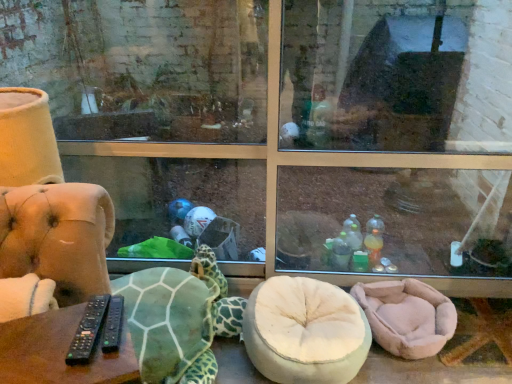
Question: Are black plastic remotes at lower left and pink plush bean bag at lower right far apart?

Choices:
 (A) yes
 (B) no

Answer: (A)

Question: Considering the relative sizes of black plastic remotes at lower left and pink plush bean bag at lower right in the image provided, is black plastic remotes at lower left bigger than pink plush bean bag at lower right?

Choices:
 (A) yes
 (B) no

Answer: (A)

Question: From a real-world perspective, is black plastic remotes at lower left over pink plush bean bag at lower right?

Choices:
 (A) no
 (B) yes

Answer: (B)

Question: Considering the relative sizes of black plastic remotes at lower left and pink plush bean bag at lower right in the image provided, is black plastic remotes at lower left taller than pink plush bean bag at lower right?

Choices:
 (A) no
 (B) yes

Answer: (B)

Question: Does black plastic remotes at lower left have a lesser height compared to pink plush bean bag at lower right?

Choices:
 (A) no
 (B) yes

Answer: (A)

Question: Based on their sizes in the image, would you say green textured fabric tortoise at lower left is bigger or smaller than pink plush bean bag at lower right?

Choices:
 (A) big
 (B) small

Answer: (A)

Question: From the image's perspective, is green textured fabric tortoise at lower left above or below pink plush bean bag at lower right?

Choices:
 (A) below
 (B) above

Answer: (B)

Question: Considering the positions of green textured fabric tortoise at lower left and pink plush bean bag at lower right in the image, is green textured fabric tortoise at lower left wider or thinner than pink plush bean bag at lower right?

Choices:
 (A) thin
 (B) wide

Answer: (B)

Question: In the image, is green textured fabric tortoise at lower left positioned in front of or behind pink plush bean bag at lower right?

Choices:
 (A) front
 (B) behind

Answer: (A)

Question: Which is correct: black plastic remotes at lower left is inside pink plush bean bag at lower right, or outside of it?

Choices:
 (A) outside
 (B) inside

Answer: (A)

Question: Considering their positions, is black plastic remotes at lower left located in front of or behind pink plush bean bag at lower right?

Choices:
 (A) front
 (B) behind

Answer: (A)

Question: In the image, is black plastic remotes at lower left on the left side or the right side of pink plush bean bag at lower right?

Choices:
 (A) right
 (B) left

Answer: (B)

Question: From the image's perspective, relative to pink plush bean bag at lower right, is black plastic remotes at lower left above or below?

Choices:
 (A) above
 (B) below

Answer: (A)

Question: In the image, is pink plush bean bag at lower right positioned in front of or behind black plastic remotes at lower left?

Choices:
 (A) behind
 (B) front

Answer: (A)

Question: Would you say pink plush bean bag at lower right is inside or outside black plastic remotes at lower left?

Choices:
 (A) inside
 (B) outside

Answer: (B)